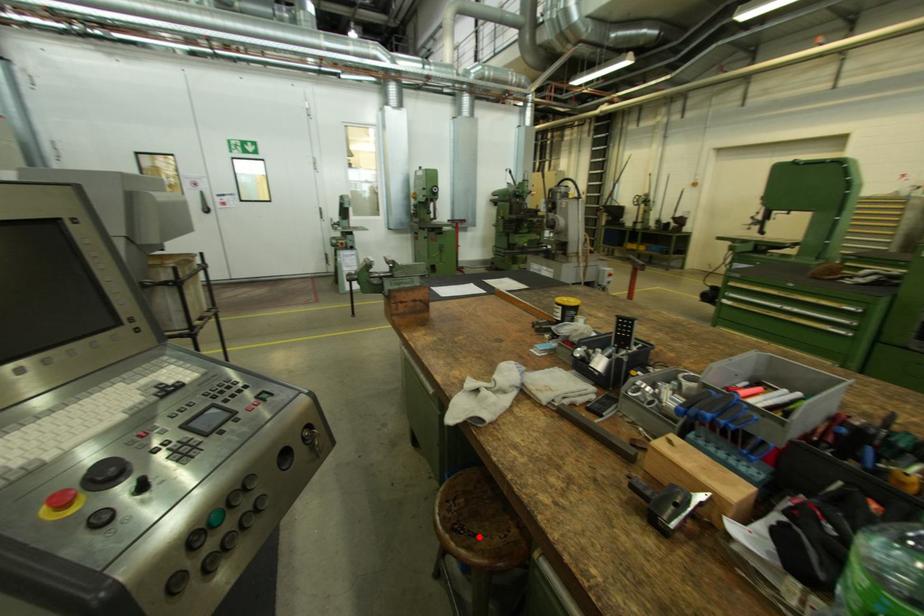
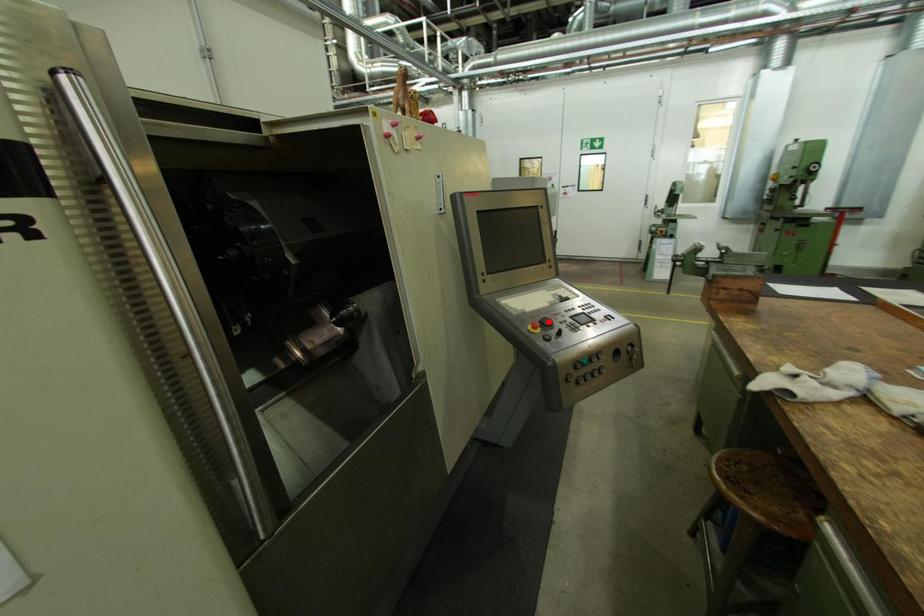
I am providing you with two images of the same scene from different viewpoints. A red point is marked on the first image and another point is marked on the second image. Is the red point in image1 aligned with the point shown in image2?

No